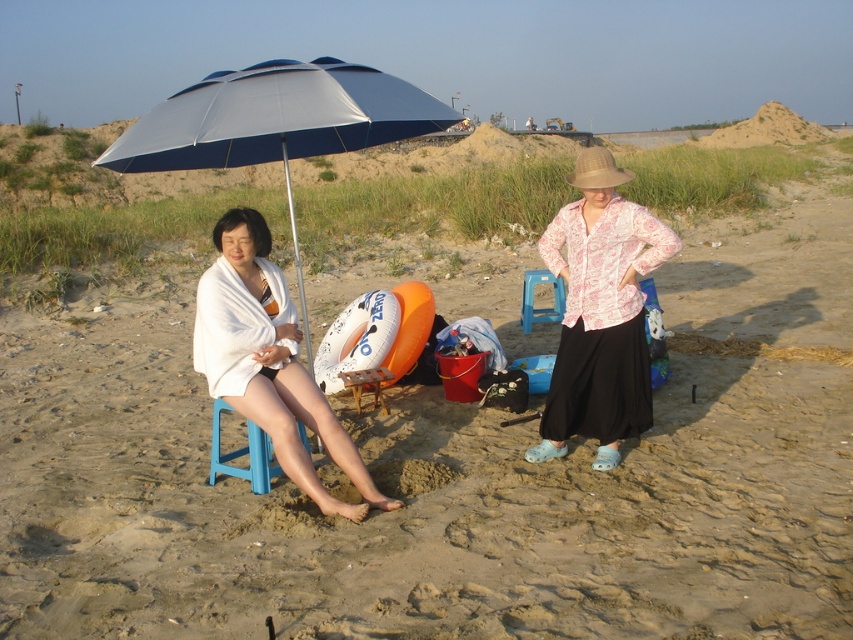
Between blue fabric umbrella at upper left and pink floral blouse at center, which one has more height?

With more height is blue fabric umbrella at upper left.

Does point (144, 125) come farther from viewer compared to point (590, 275)?

No, (144, 125) is closer to viewer.

Identify the location of blue fabric umbrella at upper left. The width and height of the screenshot is (853, 640). (277, 122).

Can you confirm if pink floral blouse at center is smaller than white towel at left?

Incorrect, pink floral blouse at center is not smaller in size than white towel at left.

Which is behind, point (625, 227) or point (242, 307)?

Point (625, 227)

Identify the location of pink floral blouse at center. (601, 312).

Is point (270, 122) positioned in front of point (527, 300)?

Yes, it is in front of point (527, 300).

Is the position of blue fabric umbrella at upper left less distant than that of blue plastic beach chair at center?

Yes, blue fabric umbrella at upper left is closer to the viewer.

Where is `blue fabric umbrella at upper left`? This screenshot has height=640, width=853. blue fabric umbrella at upper left is located at coordinates (277, 122).

At what (x,y) coordinates should I click in order to perform the action: click on blue fabric umbrella at upper left. Please return your answer as a coordinate pair (x, y). Image resolution: width=853 pixels, height=640 pixels. Looking at the image, I should click on (277, 122).